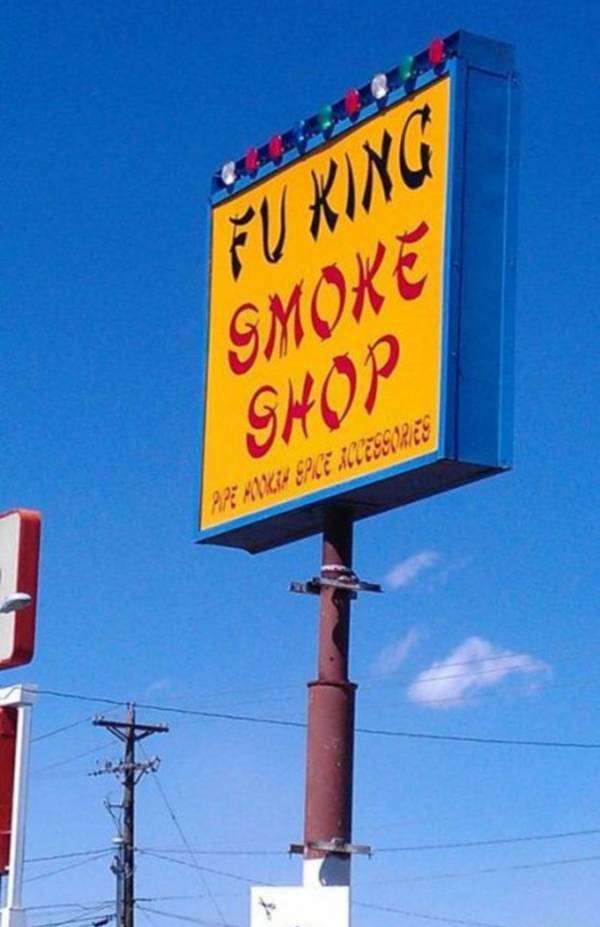
Find the location of a particular element. The width and height of the screenshot is (600, 927). light source is located at coordinates (228, 175), (436, 47), (298, 130), (324, 116).